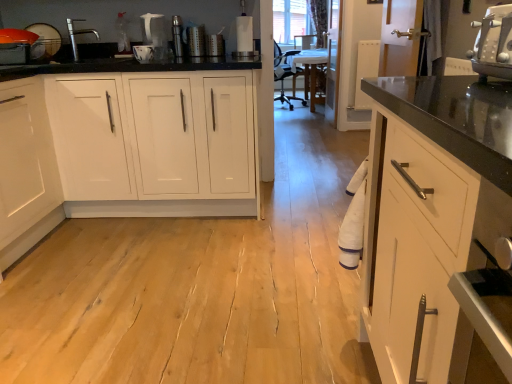
Question: Considering the relative sizes of satin nickel faucet at upper left and metallic silver grater at upper center, which is the 1th appliance from right to left, in the image provided, is satin nickel faucet at upper left taller than metallic silver grater at upper center, which is the 1th appliance from right to left,?

Choices:
 (A) no
 (B) yes

Answer: (B)

Question: Is satin nickel faucet at upper left outside metallic silver grater at upper center, which is the 1th appliance from right to left?

Choices:
 (A) yes
 (B) no

Answer: (A)

Question: Does satin nickel faucet at upper left have a greater width compared to metallic silver grater at upper center, which is the 1th appliance from right to left?

Choices:
 (A) yes
 (B) no

Answer: (A)

Question: From a real-world perspective, is satin nickel faucet at upper left over metallic silver grater at upper center, which is the third appliance from left to right?

Choices:
 (A) yes
 (B) no

Answer: (A)

Question: Is satin nickel faucet at upper left positioned behind metallic silver grater at upper center, which is the third appliance from left to right?

Choices:
 (A) no
 (B) yes

Answer: (A)

Question: Are satin nickel faucet at upper left and metallic silver grater at upper center, which is the 1th appliance from right to left, far apart?

Choices:
 (A) yes
 (B) no

Answer: (B)

Question: Can you confirm if metallic silver grater at upper center, which is the 1th appliance from right to left, is positioned to the right of satin nickel faucet at upper left?

Choices:
 (A) yes
 (B) no

Answer: (A)

Question: From a real-world perspective, is metallic silver grater at upper center, which is the third appliance from left to right, positioned under satin nickel faucet at upper left based on gravity?

Choices:
 (A) yes
 (B) no

Answer: (A)

Question: Is metallic silver grater at upper center, which is the third appliance from left to right, turned away from satin nickel faucet at upper left?

Choices:
 (A) no
 (B) yes

Answer: (A)

Question: From a real-world perspective, is metallic silver grater at upper center, which is the 1th appliance from right to left, located higher than satin nickel faucet at upper left?

Choices:
 (A) no
 (B) yes

Answer: (A)

Question: Is metallic silver grater at upper center, which is the third appliance from left to right, smaller than satin nickel faucet at upper left?

Choices:
 (A) no
 (B) yes

Answer: (B)

Question: Is metallic silver grater at upper center, which is the 1th appliance from right to left, positioned behind satin nickel faucet at upper left?

Choices:
 (A) yes
 (B) no

Answer: (A)

Question: From the image's perspective, would you say white plastic toaster at upper right is positioned over metallic silver grater at upper center, which is the 1th appliance from right to left?

Choices:
 (A) yes
 (B) no

Answer: (B)